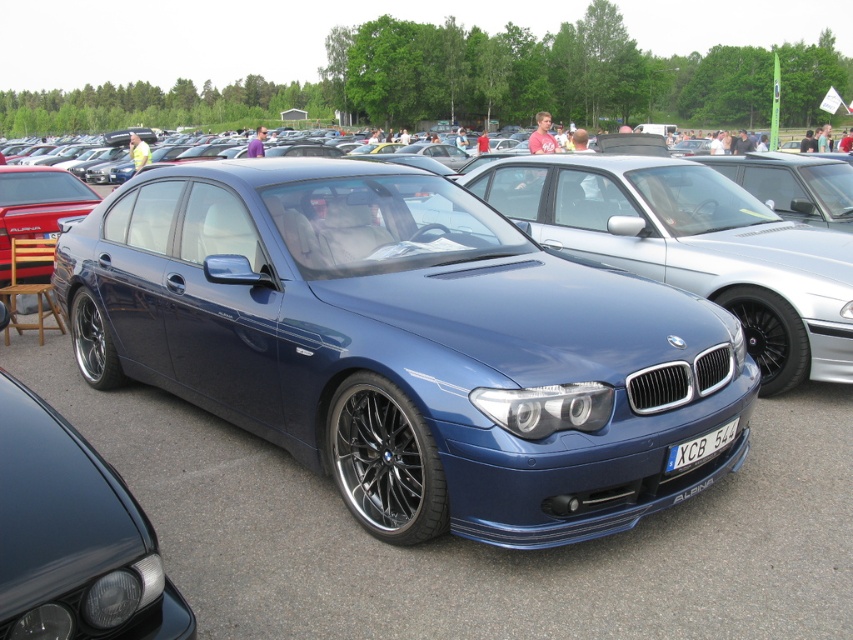
You are standing at the car show and want to take a photo of the two points mentioned. Which point, point (640, 244) or point (695, 449), is closer to you?

Point (640, 244) is closer to you because it is further to the viewer than point (695, 449).

You are at a car show and want to take a photo of the shiny red sedan at left and the satin blue car at center together in the frame. Which car should you position closer to the camera to ensure both are fully visible?

To capture both the shiny red sedan at left and the satin blue car at center in the same frame, position the shiny red sedan at left closer to the camera. Since the satin blue car at center is to the right of the shiny red sedan at left, moving the closer one forward will help include both in the photo.